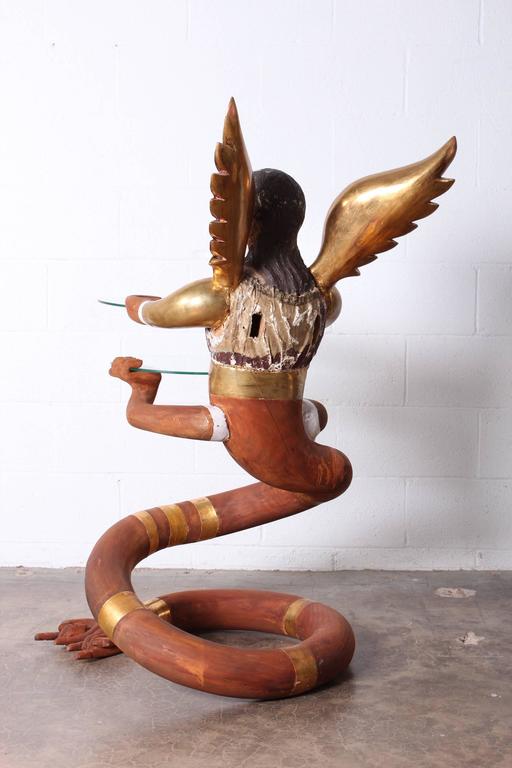
Where is `glass`? The image size is (512, 768). glass is located at coordinates (172, 369).